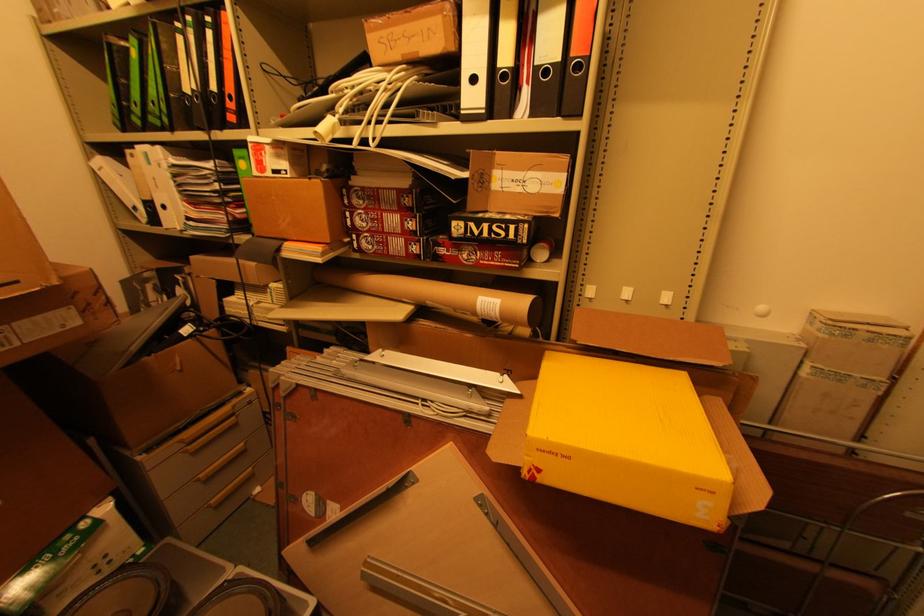
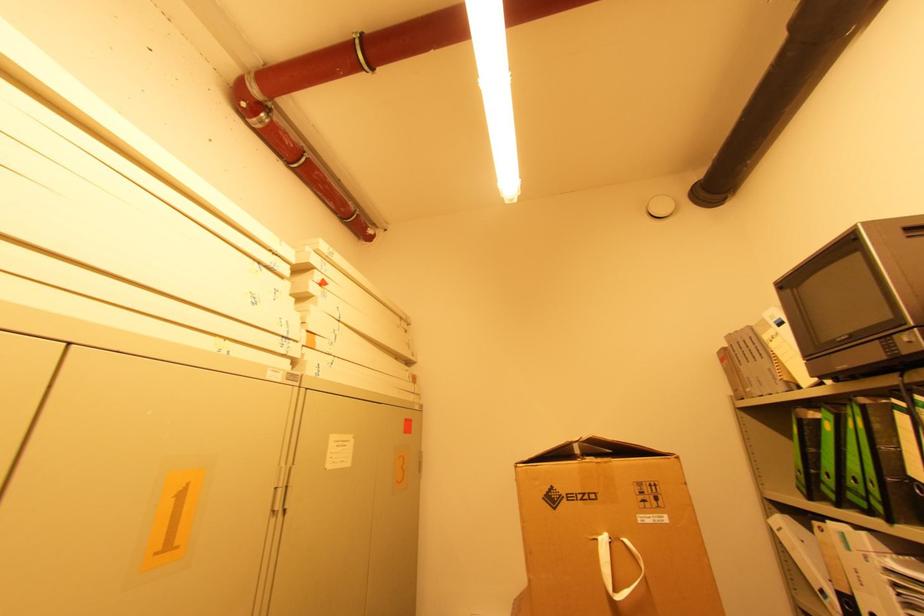
The point at (175, 130) is marked in the first image. Where is the corresponding point in the second image?

(894, 522)